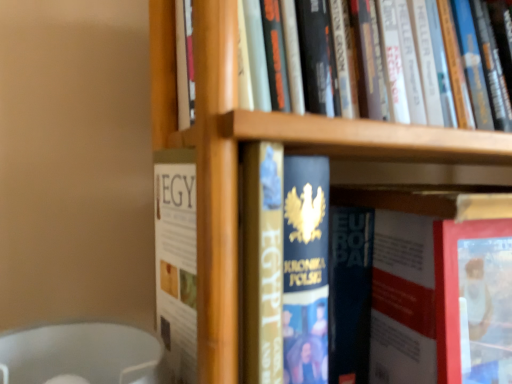
Question: Is hardcover books at upper center, the fourth book from the bottom, not near hardcover book at center, the third book from the bottom?

Choices:
 (A) yes
 (B) no

Answer: (B)

Question: Is hardcover books at upper center, the fourth book from the bottom, not inside hardcover book at center, the third book from the bottom?

Choices:
 (A) no
 (B) yes

Answer: (B)

Question: Can you confirm if hardcover books at upper center, which is counted as the first book, starting from the top, is taller than hardcover book at center, which appears as the second book when viewed from the top?

Choices:
 (A) no
 (B) yes

Answer: (A)

Question: Are hardcover books at upper center, which is counted as the first book, starting from the top, and hardcover book at center, the third book from the bottom, making contact?

Choices:
 (A) yes
 (B) no

Answer: (B)

Question: Does hardcover books at upper center, the fourth book from the bottom, turn towards hardcover book at center, which appears as the second book when viewed from the top?

Choices:
 (A) yes
 (B) no

Answer: (B)

Question: From the image's perspective, does hardcover books at upper center, the fourth book from the bottom, appear higher than hardcover book at center, the third book from the bottom?

Choices:
 (A) yes
 (B) no

Answer: (A)

Question: From the image's perspective, is hardcover book at center, placed as the fourth book when sorted from top to bottom, on top of hardcover book at center, the third book from the bottom?

Choices:
 (A) yes
 (B) no

Answer: (B)

Question: Is hardcover book at center, placed as the fourth book when sorted from top to bottom, wider than hardcover book at center, the third book from the bottom?

Choices:
 (A) no
 (B) yes

Answer: (A)

Question: Is hardcover book at center, placed as the fourth book when sorted from top to bottom, taller than hardcover book at center, the third book from the bottom?

Choices:
 (A) no
 (B) yes

Answer: (A)

Question: Considering the relative sizes of hardcover book at center, placed as the fourth book when sorted from top to bottom, and hardcover book at center, the third book from the bottom, in the image provided, is hardcover book at center, placed as the fourth book when sorted from top to bottom, bigger than hardcover book at center, the third book from the bottom,?

Choices:
 (A) no
 (B) yes

Answer: (B)

Question: Would you say hardcover book at center, which appears as the second book when viewed from the top, is part of hardcover book at center, which is the 1th book in bottom-to-top order,'s contents?

Choices:
 (A) no
 (B) yes

Answer: (A)

Question: From a real-world perspective, is hardcover book at center, which is the 1th book in bottom-to-top order, positioned over hardcover book at center, which appears as the second book when viewed from the top, based on gravity?

Choices:
 (A) no
 (B) yes

Answer: (A)

Question: From a real-world perspective, is hardcover book at center, placed as the fourth book when sorted from top to bottom, below hardcover book at center?

Choices:
 (A) yes
 (B) no

Answer: (A)